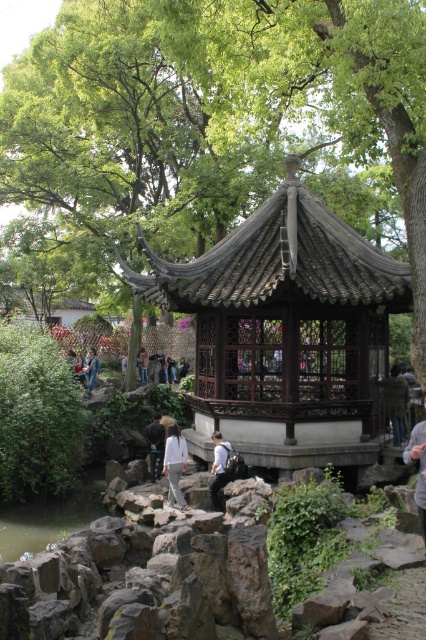
Question: Based on their relative distances, which object is farther from the dark gray fabric jacket at center?

Choices:
 (A) wooden lattice gazebo at center
 (B) white cotton shirt at center
 (C) green liquid water at lower left

Answer: (B)

Question: Which is farther from the white fabric at center?

Choices:
 (A) dark gray fabric jacket at center
 (B) wooden lattice gazebo at center
 (C) green leafy tree at upper center
 (D) denim jacket at center

Answer: (C)

Question: Is the position of dark gray fabric jacket at center less distant than that of white fabric at center?

Choices:
 (A) no
 (B) yes

Answer: (B)

Question: Is green liquid water at lower left positioned behind denim jacket at center?

Choices:
 (A) yes
 (B) no

Answer: (B)

Question: Is white cotton pants at center positioned before white fabric shirt at center?

Choices:
 (A) no
 (B) yes

Answer: (B)

Question: Which point appears closest to the camera in this image?

Choices:
 (A) (422, 444)
 (B) (92, 372)
 (C) (169, 472)
 (D) (180, 294)

Answer: (A)